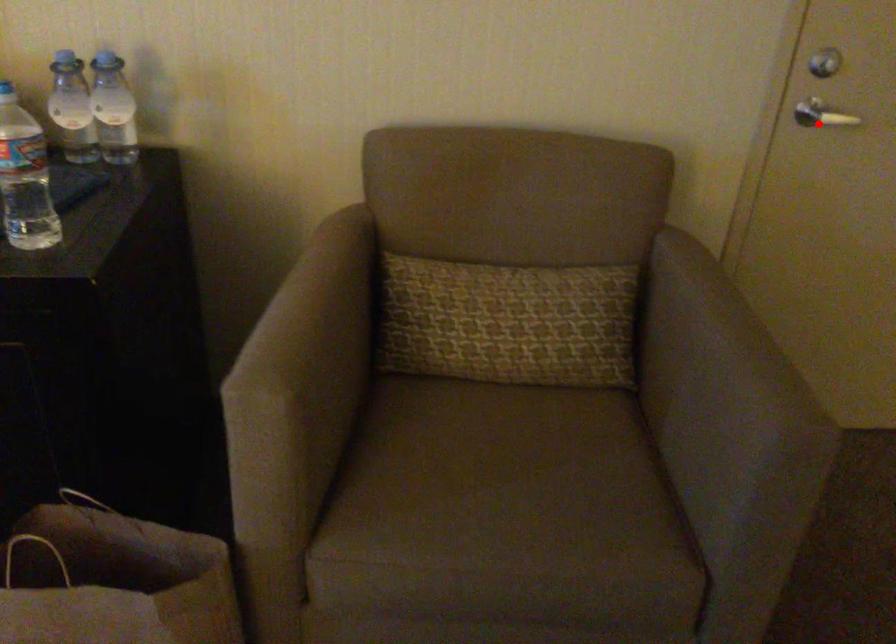
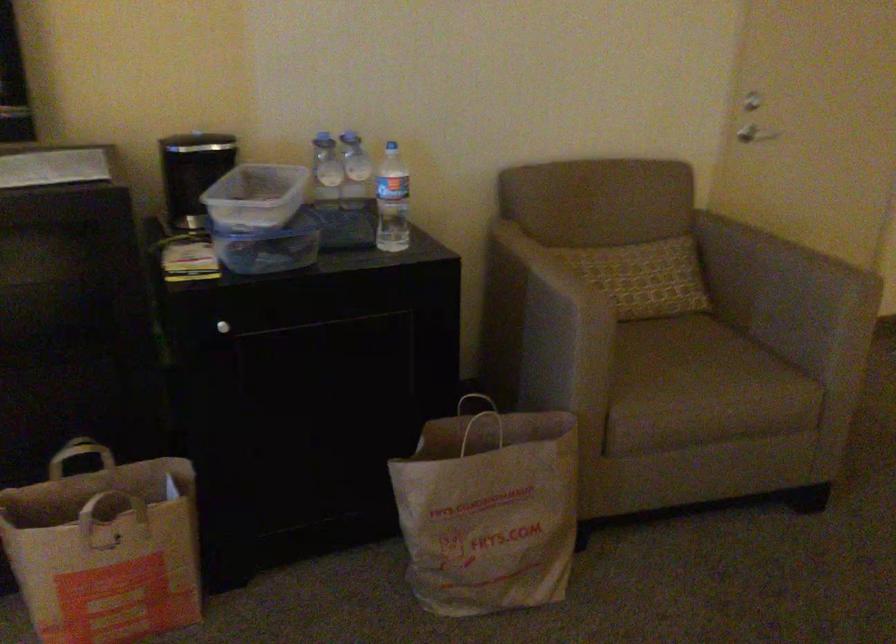
Question: I am providing you with two images of the same scene from different viewpoints. In image1, a red point is highlighted. Considering the same 3D point in image2, which of the following is correct?

Choices:
 (A) It is closer
 (B) It is farther

Answer: (B)